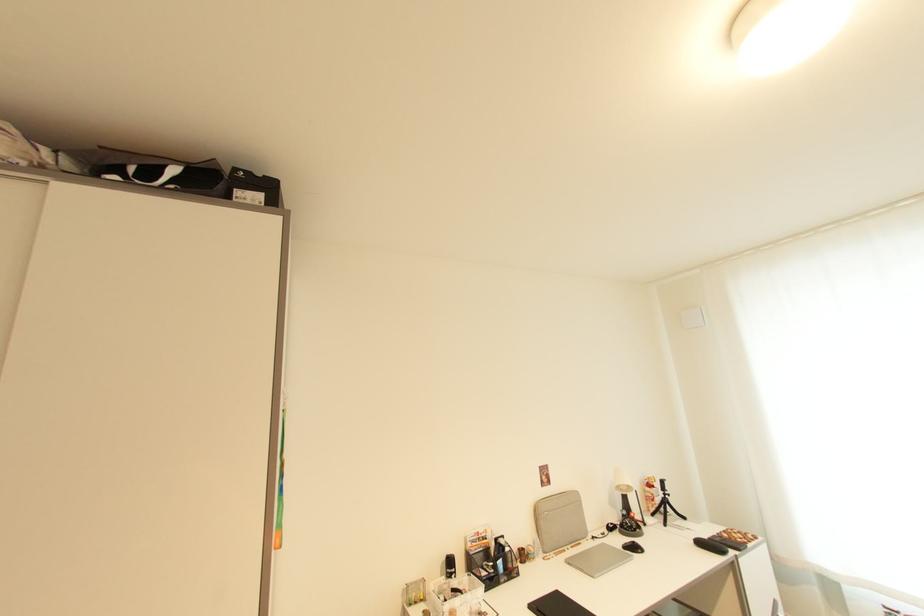
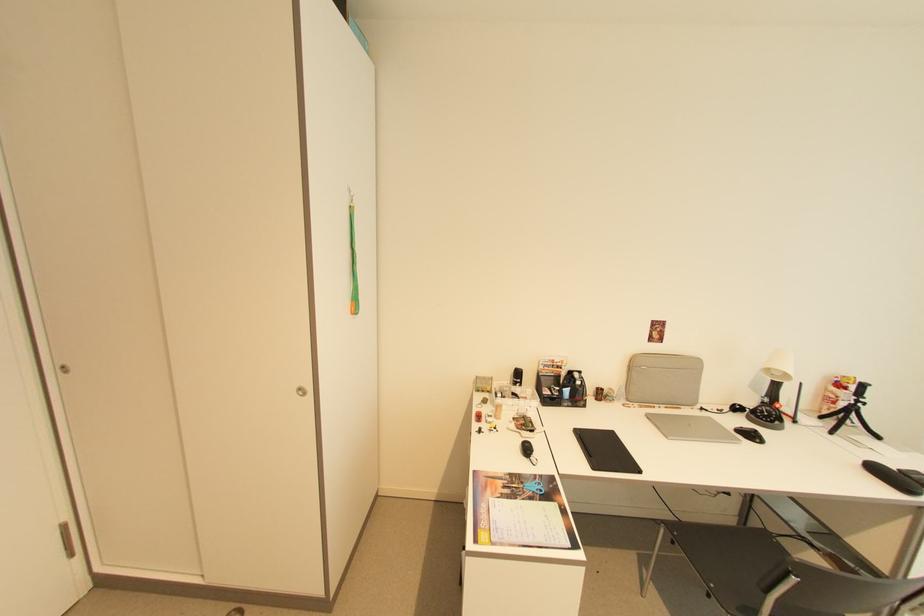
In the second image, find the point that corresponds to (669,498) in the first image.

(857, 405)